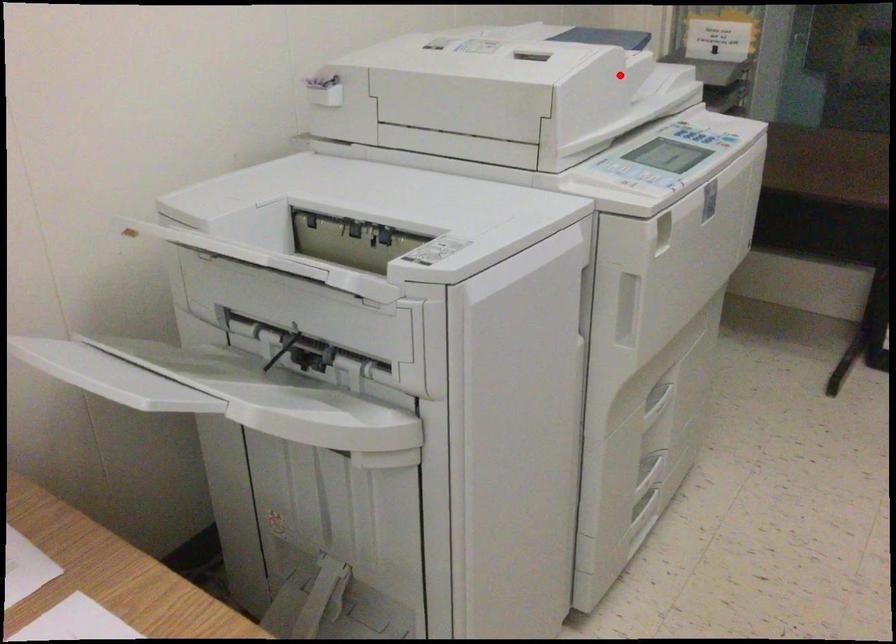
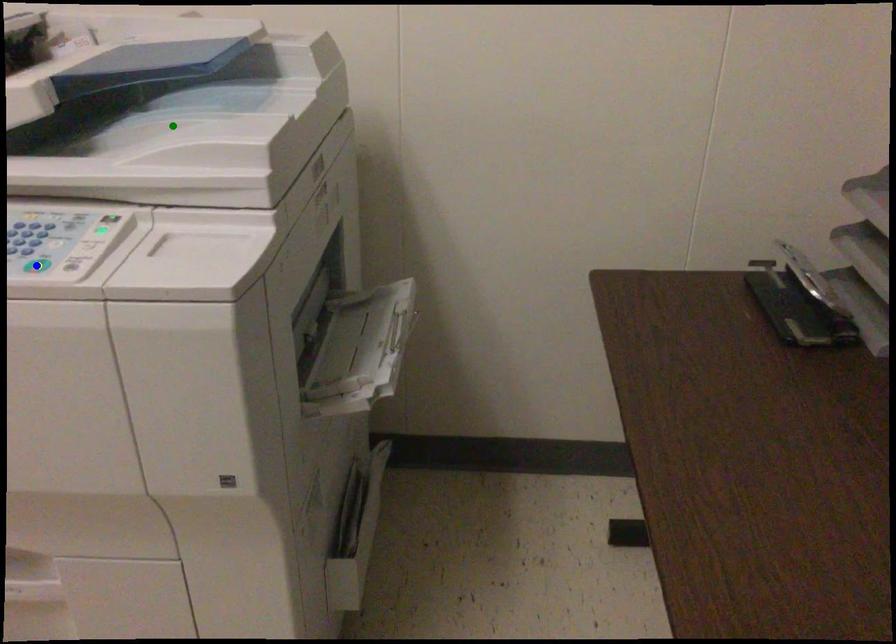
Question: I am providing you with two images of the same scene from different viewpoints. A red point is marked on the first image. You are given multiple points on the second image. Which mark in image 2 goes with the point in image 1?

Choices:
 (A) yellow point
 (B) green point
 (C) blue point

Answer: (B)